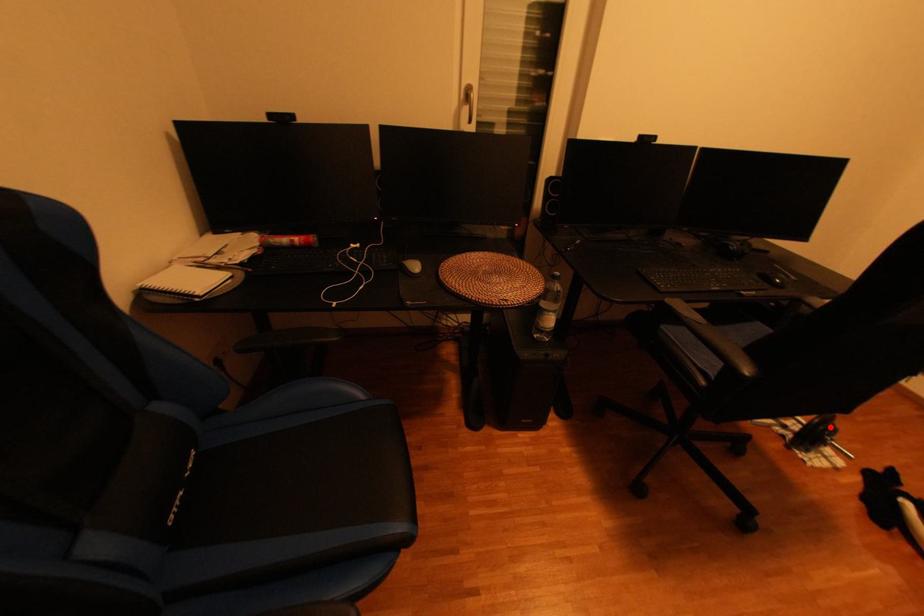
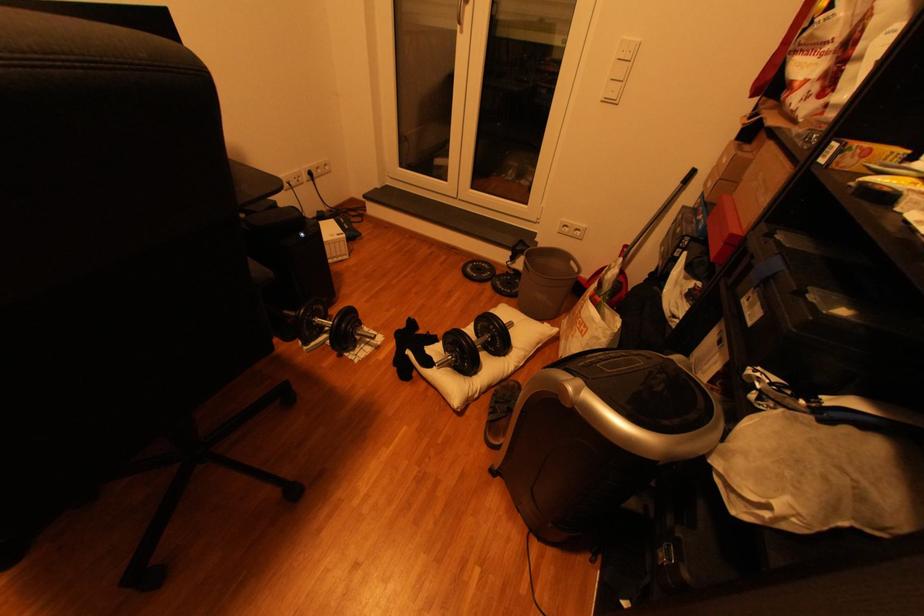
Question: I am providing you with two images of the same scene from different viewpoints. Given a red point in image1, look at the same physical point in image2. Is it:

Choices:
 (A) Closer to the viewpoint
 (B) Farther from the viewpoint

Answer: (A)